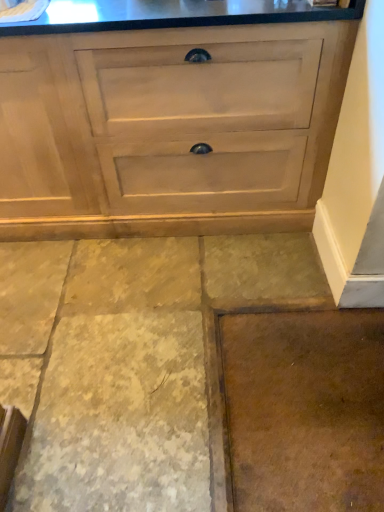
Question: In the image, is matte wood chest of drawers at center positioned in front of or behind brown stone floor at lower center, which ranks as the second concrete in right-to-left order?

Choices:
 (A) front
 (B) behind

Answer: (B)

Question: Based on their sizes in the image, would you say matte wood chest of drawers at center is bigger or smaller than brown stone floor at lower center, which ranks as the second concrete in right-to-left order?

Choices:
 (A) big
 (B) small

Answer: (A)

Question: Which object is positioned closest to the brown stone floor at lower center, marked as the first concrete in a left-to-right arrangement?

Choices:
 (A) brown matte concrete at lower right, the second concrete from the left
 (B) matte wood chest of drawers at center

Answer: (A)

Question: Estimate the real-world distances between objects in this image. Which object is closer to the brown stone floor at lower center, which ranks as the second concrete in right-to-left order?

Choices:
 (A) matte wood chest of drawers at center
 (B) brown matte concrete at lower right, the 1th concrete in the right-to-left sequence

Answer: (B)